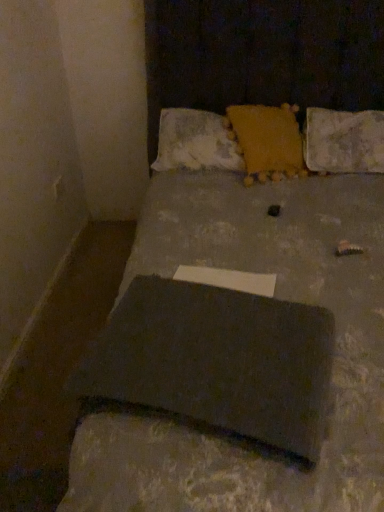
Question: Considering the relative sizes of slate at center and matte gray laptop at center in the image provided, is slate at center smaller than matte gray laptop at center?

Choices:
 (A) yes
 (B) no

Answer: (A)

Question: Is slate at center to the right of matte gray laptop at center from the viewer's perspective?

Choices:
 (A) no
 (B) yes

Answer: (A)

Question: From a real-world perspective, is slate at center physically below matte gray laptop at center?

Choices:
 (A) no
 (B) yes

Answer: (B)

Question: Does slate at center have a lesser height compared to matte gray laptop at center?

Choices:
 (A) no
 (B) yes

Answer: (B)

Question: Is slate at center positioned with its back to matte gray laptop at center?

Choices:
 (A) no
 (B) yes

Answer: (B)

Question: From the image's perspective, is textured yellow pillow at upper right, which is counted as the first pillow, starting from the right, positioned above or below slate at center?

Choices:
 (A) above
 (B) below

Answer: (A)

Question: Is textured yellow pillow at upper right, which is counted as the first pillow, starting from the right, spatially inside slate at center, or outside of it?

Choices:
 (A) inside
 (B) outside

Answer: (B)

Question: Looking at their shapes, would you say textured yellow pillow at upper right, which is counted as the first pillow, starting from the right, is wider or thinner than slate at center?

Choices:
 (A) wide
 (B) thin

Answer: (A)

Question: Is textured yellow pillow at upper right, marked as the 3th pillow in a left-to-right arrangement, in front of or behind slate at center in the image?

Choices:
 (A) front
 (B) behind

Answer: (B)

Question: From the image's perspective, is yellow fuzzy pillow at upper center, the second pillow viewed from the right, positioned above or below textured yellow pillow at upper right, which is counted as the first pillow, starting from the right?

Choices:
 (A) above
 (B) below

Answer: (A)

Question: In terms of size, does yellow fuzzy pillow at upper center, placed as the second pillow when sorted from left to right, appear bigger or smaller than textured yellow pillow at upper right, which is counted as the first pillow, starting from the right?

Choices:
 (A) small
 (B) big

Answer: (A)

Question: Is point (288, 138) positioned closer to the camera than point (324, 158)?

Choices:
 (A) farther
 (B) closer

Answer: (A)

Question: From their relative heights in the image, would you say yellow fuzzy pillow at upper center, the second pillow viewed from the right, is taller or shorter than textured yellow pillow at upper right, which is counted as the first pillow, starting from the right?

Choices:
 (A) tall
 (B) short

Answer: (A)

Question: Considering their positions, is yellow fuzzy pillow at upper center, the second pillow viewed from the right, located in front of or behind matte gray laptop at center?

Choices:
 (A) front
 (B) behind

Answer: (B)

Question: Is yellow fuzzy pillow at upper center, placed as the second pillow when sorted from left to right, bigger or smaller than matte gray laptop at center?

Choices:
 (A) small
 (B) big

Answer: (A)